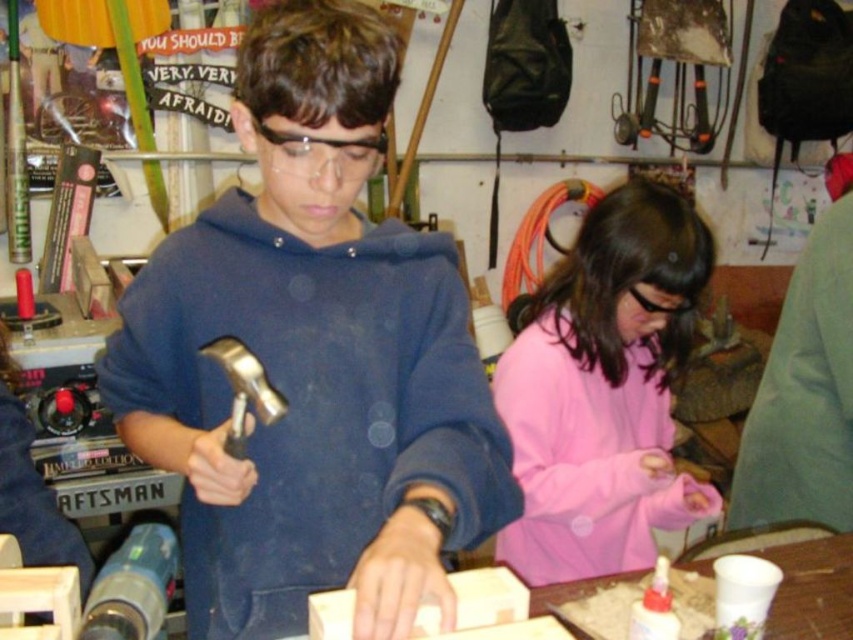
Question: Can you confirm if metallic hammer at center is bigger than pink fabric at lower right?

Choices:
 (A) no
 (B) yes

Answer: (B)

Question: Among these objects, which one is nearest to the camera?

Choices:
 (A) metallic hammer at center
 (B) pink fabric at lower right

Answer: (A)

Question: Can you confirm if metallic hammer at center is positioned above pink fabric at lower right?

Choices:
 (A) no
 (B) yes

Answer: (B)

Question: Considering the real-world distances, which object is closest to the metallic hammer at center?

Choices:
 (A) pink fabric at lower right
 (B) gold metallic hammer at center

Answer: (B)

Question: Which point is farther to the camera?

Choices:
 (A) metallic hammer at center
 (B) pink fabric at lower right

Answer: (B)

Question: Considering the relative positions of metallic hammer at center and pink fabric at lower right in the image provided, where is metallic hammer at center located with respect to pink fabric at lower right?

Choices:
 (A) above
 (B) below

Answer: (A)